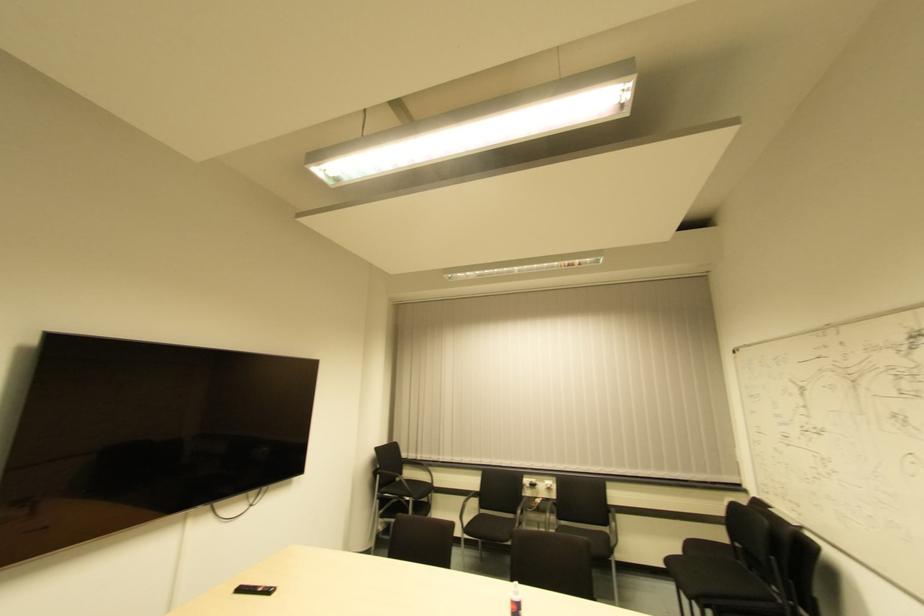
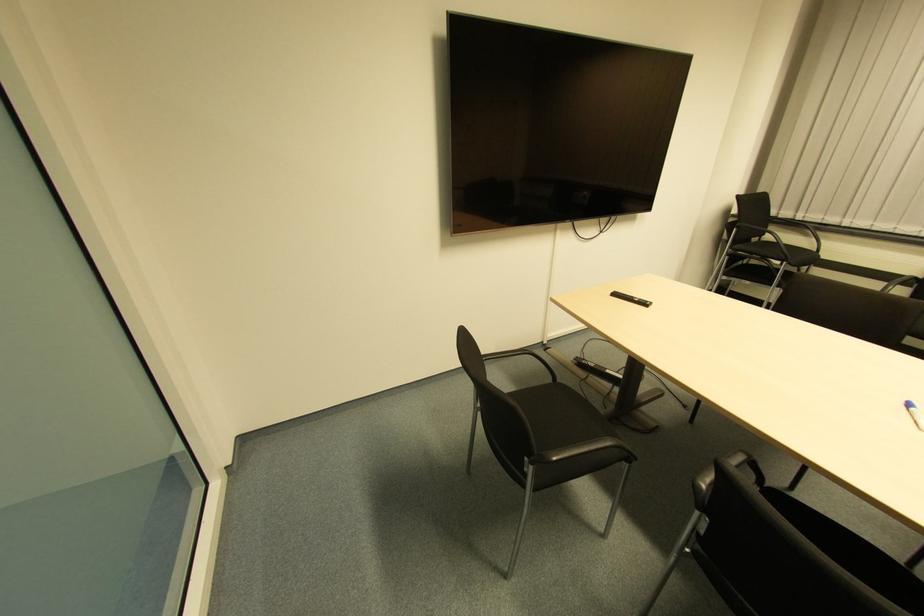
Find the pixel in the second image that matches [395,482] in the first image.

(752, 243)